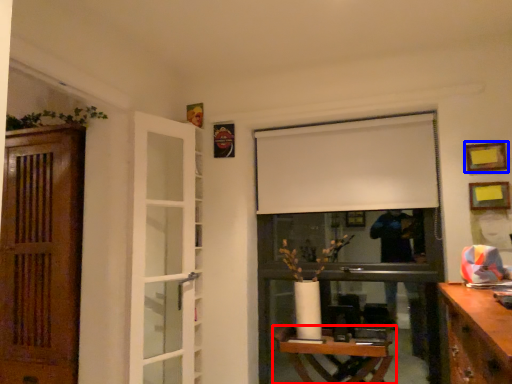
Question: Among these objects, which one is nearest to the camera, table (highlighted by a red box) or picture frame (highlighted by a blue box)?

Choices:
 (A) table
 (B) picture frame

Answer: (A)